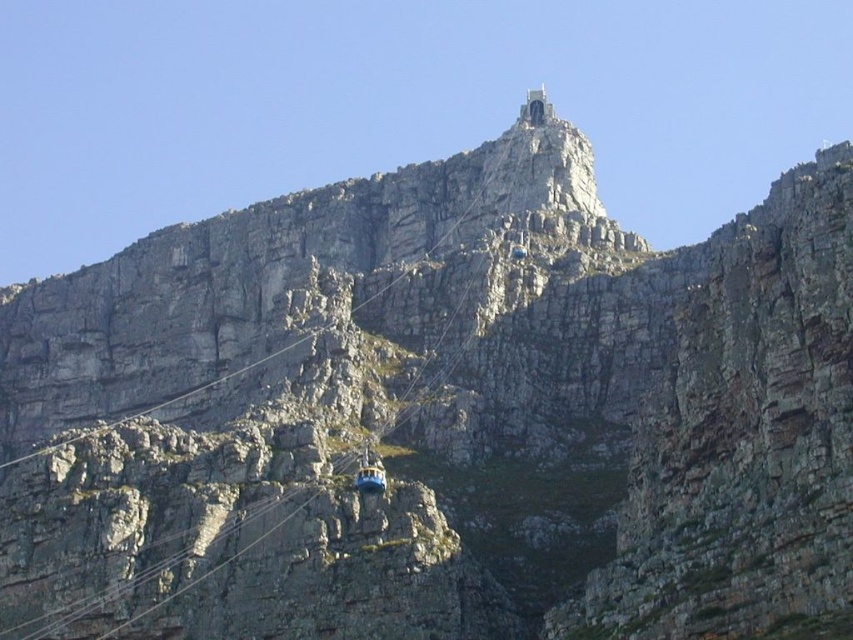
Who is positioned more to the right, metallic yellow cable car at center or blue metallic cable car at upper center?

From the viewer's perspective, blue metallic cable car at upper center appears more on the right side.

Consider the image. Does metallic yellow cable car at center appear on the left side of blue metallic cable car at upper center?

Correct, you'll find metallic yellow cable car at center to the left of blue metallic cable car at upper center.

Where is `metallic yellow cable car at center`? metallic yellow cable car at center is located at coordinates (370, 477).

The height and width of the screenshot is (640, 853). What do you see at coordinates (535, 108) in the screenshot?
I see `smooth stone peak at upper center` at bounding box center [535, 108].

Can you confirm if smooth stone peak at upper center is bigger than metallic yellow cable car at center?

Yes.

Is point (549, 115) less distant than point (364, 474)?

No.

This screenshot has width=853, height=640. Find the location of `smooth stone peak at upper center`. smooth stone peak at upper center is located at coordinates click(x=535, y=108).

Is point (550, 108) less distant than point (511, 253)?

No, it is not.

Where is `smooth stone peak at upper center`? This screenshot has height=640, width=853. smooth stone peak at upper center is located at coordinates (535, 108).